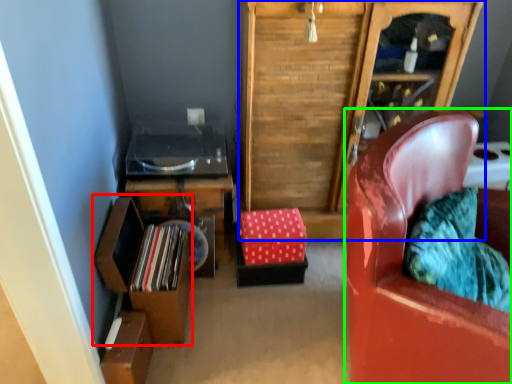
Question: Which object is the closest to the shelf (highlighted by a red box)? Choose among these: cabinetry (highlighted by a blue box) or chair (highlighted by a green box).

Choices:
 (A) cabinetry
 (B) chair

Answer: (A)